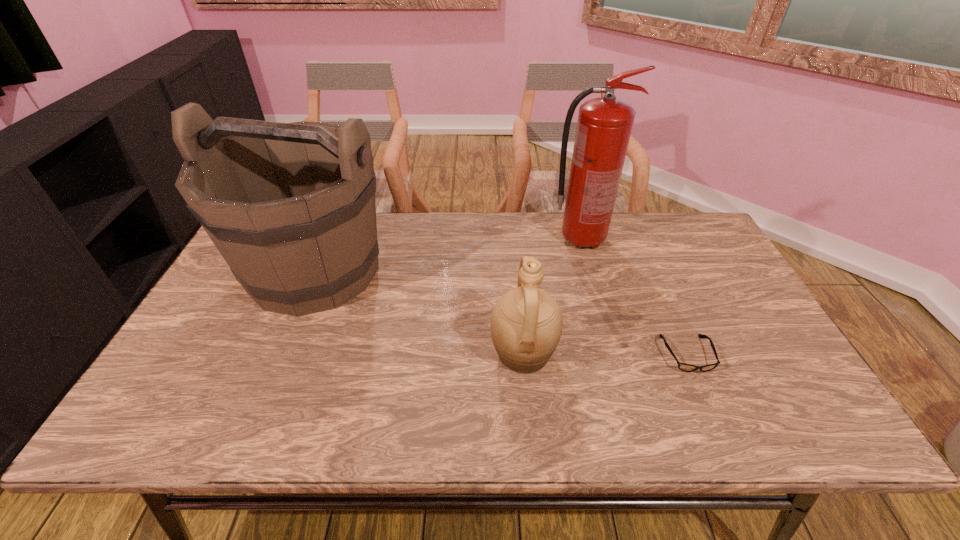
The width and height of the screenshot is (960, 540). Identify the location of the second object from right to left. (x=604, y=125).

The image size is (960, 540). I want to click on bucket, so click(291, 207).

Find the location of a particular element. the second shortest object is located at coordinates (526, 324).

This screenshot has height=540, width=960. In order to click on the third object from right to left in this screenshot , I will do `click(526, 324)`.

The height and width of the screenshot is (540, 960). I want to click on the shortest object, so click(684, 367).

Image resolution: width=960 pixels, height=540 pixels. In order to click on the rightmost object in this screenshot , I will do click(684, 367).

Locate an element on the screen. free space located on the handle side the third object from left to right is located at coordinates (629, 240).

I want to click on vacant position located 0.270m on the front of the bucket, so click(250, 423).

Where is `vacant space located on the back of the second shortest object`? This screenshot has height=540, width=960. vacant space located on the back of the second shortest object is located at coordinates (514, 242).

Image resolution: width=960 pixels, height=540 pixels. Identify the location of vacant space located 0.080m on the front-facing side of the shortest object. (709, 405).